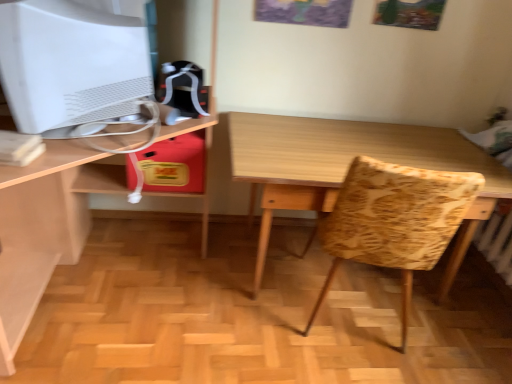
Question: Is wooden table at center beside wooden desk at center?

Choices:
 (A) yes
 (B) no

Answer: (B)

Question: Is wooden table at center thinner than wooden desk at center?

Choices:
 (A) no
 (B) yes

Answer: (B)

Question: From a real-world perspective, is wooden table at center positioned under wooden desk at center based on gravity?

Choices:
 (A) no
 (B) yes

Answer: (B)

Question: Can wooden desk at center be found inside wooden table at center?

Choices:
 (A) no
 (B) yes

Answer: (A)

Question: Considering the relative positions of wooden table at center and wooden desk at center in the image provided, is wooden table at center to the right of wooden desk at center from the viewer's perspective?

Choices:
 (A) yes
 (B) no

Answer: (A)

Question: From the image's perspective, is patterned fabric swivel chair at center located above or below wooden table at center?

Choices:
 (A) above
 (B) below

Answer: (B)

Question: Is patterned fabric swivel chair at center bigger or smaller than wooden table at center?

Choices:
 (A) big
 (B) small

Answer: (B)

Question: From a real-world perspective, relative to wooden table at center, is patterned fabric swivel chair at center vertically above or below?

Choices:
 (A) above
 (B) below

Answer: (A)

Question: Looking at their shapes, would you say patterned fabric swivel chair at center is wider or thinner than wooden table at center?

Choices:
 (A) thin
 (B) wide

Answer: (A)

Question: Is point (64, 233) positioned closer to the camera than point (95, 89)?

Choices:
 (A) farther
 (B) closer

Answer: (A)

Question: From a real-world perspective, is wooden desk at center above or below white matte computer monitor at upper left?

Choices:
 (A) below
 (B) above

Answer: (A)

Question: In terms of width, does wooden desk at center look wider or thinner when compared to white matte computer monitor at upper left?

Choices:
 (A) thin
 (B) wide

Answer: (B)

Question: Visually, is wooden desk at center positioned to the left or to the right of white matte computer monitor at upper left?

Choices:
 (A) left
 (B) right

Answer: (A)

Question: In the image, is wooden desk at center on the left side or the right side of wooden table at center?

Choices:
 (A) right
 (B) left

Answer: (B)

Question: Is point (8, 125) closer or farther from the camera than point (313, 152)?

Choices:
 (A) closer
 (B) farther

Answer: (A)